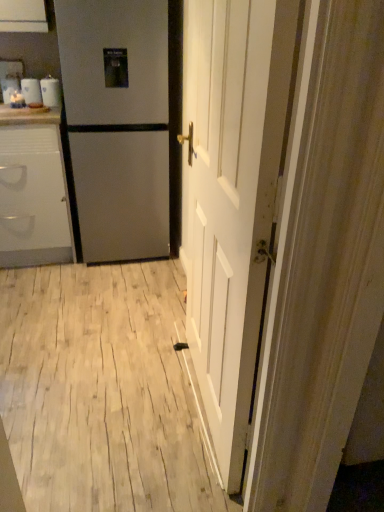
I want to click on vacant space that is to the left of white wooden door at center, so click(x=106, y=396).